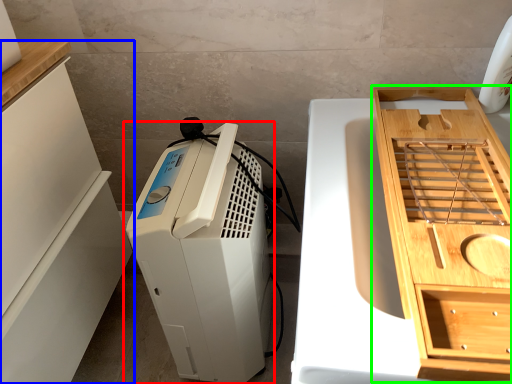
Question: Which object is the closest to the home appliance (highlighted by a red box)? Choose among these: cabinetry (highlighted by a blue box) or cabinetry (highlighted by a green box).

Choices:
 (A) cabinetry
 (B) cabinetry

Answer: (A)